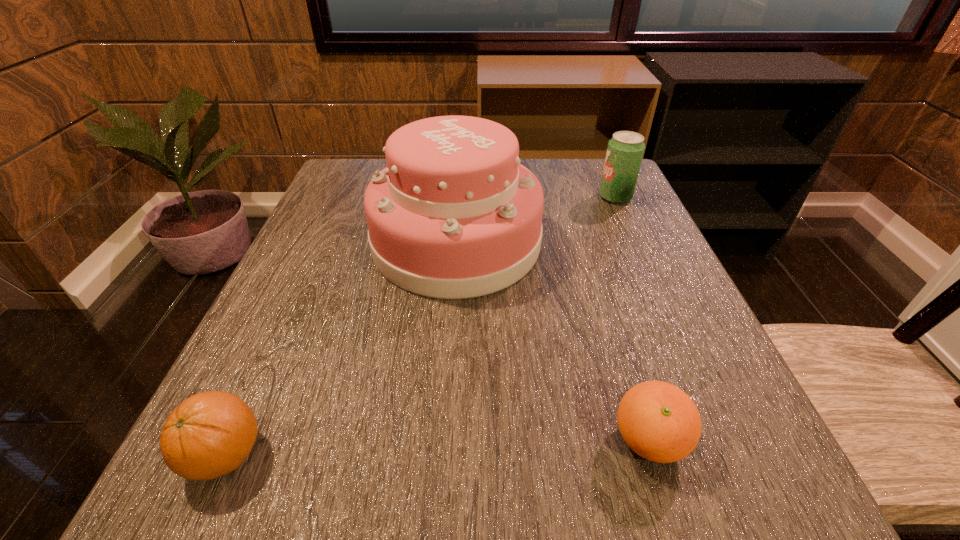
At what (x,y) coordinates should I click in order to perform the action: click on birthday cake at the far edge. Please return your answer as a coordinate pair (x, y). Looking at the image, I should click on (454, 215).

This screenshot has width=960, height=540. I want to click on soda at the far edge, so click(x=625, y=150).

Where is `birthday cake that is positioned at the left edge`? birthday cake that is positioned at the left edge is located at coordinates (454, 215).

I want to click on orange present at the left edge, so click(210, 434).

Image resolution: width=960 pixels, height=540 pixels. What are the coordinates of `soda positioned at the right edge` in the screenshot? It's located at (625, 150).

This screenshot has height=540, width=960. Identify the location of orange that is positioned at the right edge. (658, 421).

Image resolution: width=960 pixels, height=540 pixels. Find the location of `object that is at the far left corner`. object that is at the far left corner is located at coordinates (454, 215).

Where is `object located in the near left corner section of the desktop`? object located in the near left corner section of the desktop is located at coordinates (210, 434).

Locate an element on the screen. The height and width of the screenshot is (540, 960). object that is positioned at the far right corner is located at coordinates (625, 150).

Identify the location of object that is at the near right corner. This screenshot has height=540, width=960. pos(658,421).